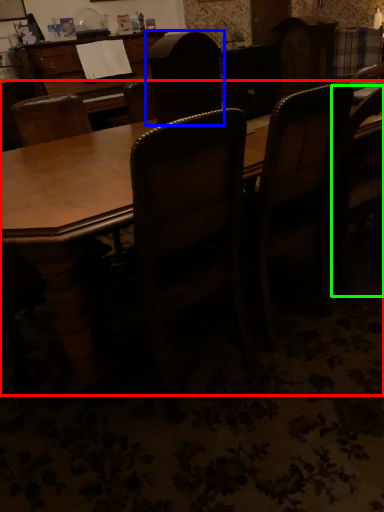
Question: Based on their relative distances, which object is farther from table (highlighted by a red box)? Choose from chair (highlighted by a blue box) and chair (highlighted by a green box).

Choices:
 (A) chair
 (B) chair

Answer: (B)